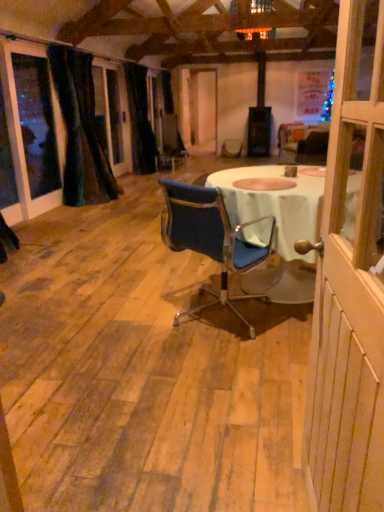
Locate an element on the screen. This screenshot has height=512, width=384. vacant space in front of blue fabric chair at center is located at coordinates (215, 375).